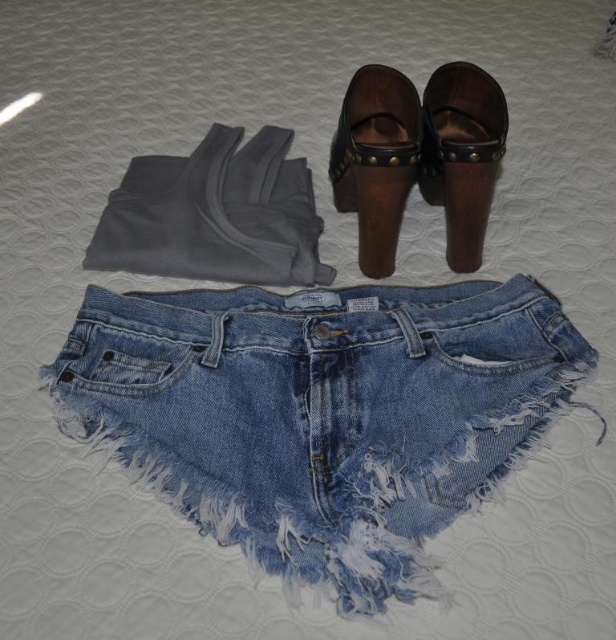
Does gray fleece pants at upper left appear over brown leather clog at upper center?

Actually, gray fleece pants at upper left is below brown leather clog at upper center.

Does point (277, 220) lie in front of point (455, 113)?

No, (277, 220) is further to viewer.

At what (x,y) coordinates should I click in order to perform the action: click on gray fleece pants at upper left. Please return your answer as a coordinate pair (x, y). Image resolution: width=616 pixels, height=640 pixels. Looking at the image, I should click on (216, 214).

Who is positioned more to the right, faded denim shorts at center or brown leather sandal at upper center?

brown leather sandal at upper center

Which is below, faded denim shorts at center or brown leather sandal at upper center?

faded denim shorts at center

Who is more forward, (118, 339) or (360, 196)?

Point (118, 339) is in front.

This screenshot has width=616, height=640. Identify the location of faded denim shorts at center. (322, 412).

Between brown leather sandal at upper center and brown leather clog at upper center, which one has less height?

With less height is brown leather clog at upper center.

Is point (386, 100) more distant than point (480, 237)?

No, it is not.

Where is `brown leather sandal at upper center`? The height and width of the screenshot is (640, 616). brown leather sandal at upper center is located at coordinates (375, 161).